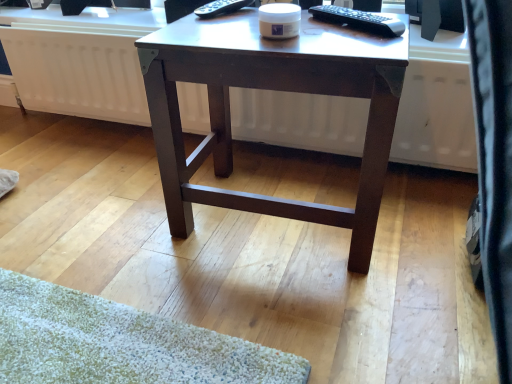
Find the location of a particular element. The image size is (512, 384). vacant space to the left of black plastic remote control at upper right, the second remote control when ordered from back to front is located at coordinates (263, 38).